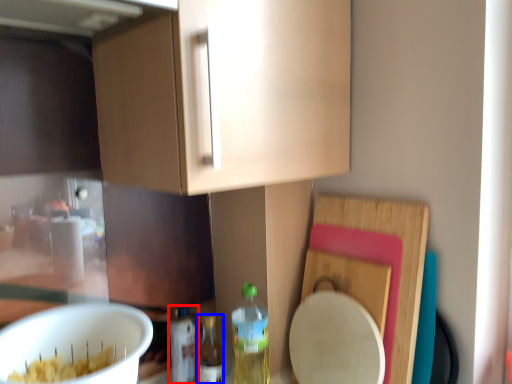
Question: Which object appears farthest to the camera in this image, bottle (highlighted by a red box) or bottle (highlighted by a blue box)?

Choices:
 (A) bottle
 (B) bottle

Answer: (A)